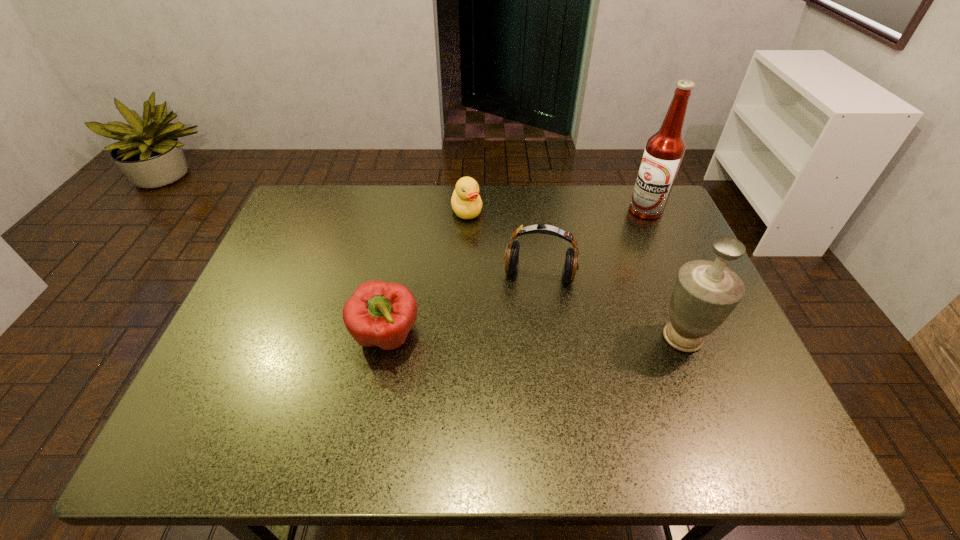
Locate an element on the screen. the leftmost object is located at coordinates point(379,313).

Find the location of `urn`. urn is located at coordinates (705, 293).

Identify the location of alcohol. The width and height of the screenshot is (960, 540). (664, 151).

At what (x,y) coordinates should I click in order to perform the action: click on duck. Please return your answer as a coordinate pair (x, y). Looking at the image, I should click on (466, 203).

Where is `the shortest object`? This screenshot has height=540, width=960. the shortest object is located at coordinates (466, 203).

Locate an element on the screen. The height and width of the screenshot is (540, 960). the third object from right to left is located at coordinates (511, 257).

Identify the location of the third nearest object. Image resolution: width=960 pixels, height=540 pixels. (511, 257).

At what (x,y) coordinates should I click in order to perform the action: click on free location located on the right of the leftmost object. Please return your answer as a coordinate pair (x, y). The width and height of the screenshot is (960, 540). Looking at the image, I should click on pyautogui.click(x=588, y=336).

Image resolution: width=960 pixels, height=540 pixels. What are the coordinates of `free location located 0.350m on the back of the urn` in the screenshot? It's located at (637, 226).

I want to click on vacant space situated on the label side of the tallest object, so click(x=627, y=243).